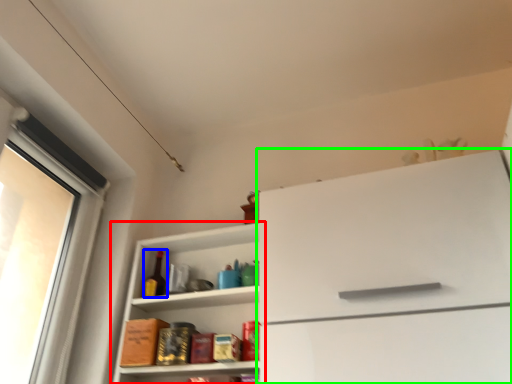
Question: Which object is the farthest from shelf (highlighted by a red box)? Choose among these: bottle (highlighted by a blue box) or cabinetry (highlighted by a green box).

Choices:
 (A) bottle
 (B) cabinetry

Answer: (B)